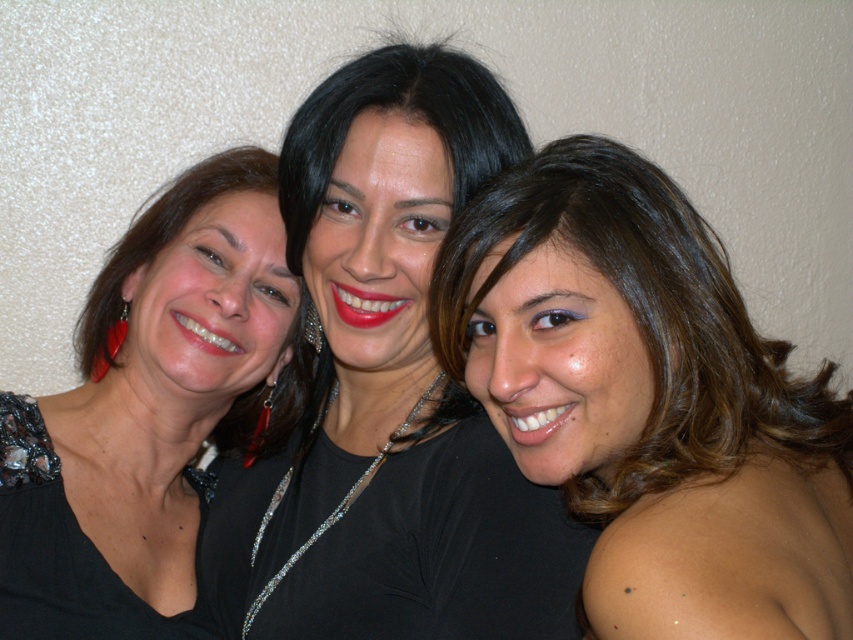
You are a photographer trying to adjust the lighting for a portrait. You have a light source that can only illuminate an area of 6 inches. Given the distance between the brown shiny hair at center and the matte black shirt at center, will the light source be sufficient to cover both objects?

The distance between the brown shiny hair at center and the matte black shirt at center is 6.47 inches, which is slightly more than the 6 inches the light source can cover. Therefore, the light source will not be sufficient to cover both objects.

Consider the image. You are standing in front of the three women in the image. There are two points marked in the scene. Which point, point [694,326] or point [320,132], is closer to you?

Point [694,326] is closer to the viewer than point [320,132].

You are standing in front of the three women in the photograph. You want to place a small decoration between the two points indicated by the coordinates point (x=418, y=413) and point (x=22, y=481). Which point should the decoration be closer to in order to be in front of both?

The decoration should be closer to point (x=418, y=413) because it is in front of point (x=22, y=481) according to the spatial relationship provided.